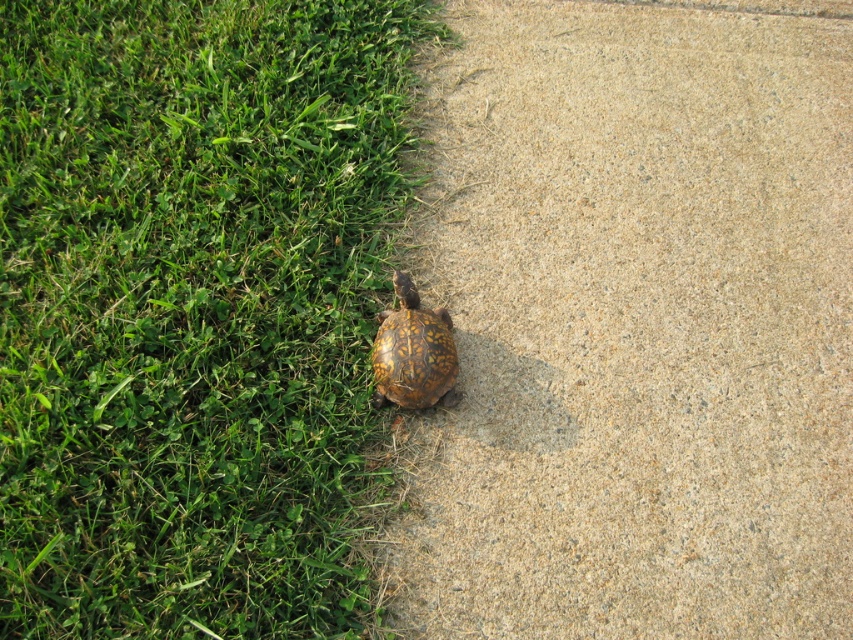
Does point (363, 582) lie in front of point (397, 324)?

Yes.

Is green grass at lower left to the left of brown textured shell at lower center from the viewer's perspective?

Indeed, green grass at lower left is positioned on the left side of brown textured shell at lower center.

Find the location of a particular element. The image size is (853, 640). green grass at lower left is located at coordinates (192, 307).

Where is `green grass at lower left`? This screenshot has width=853, height=640. green grass at lower left is located at coordinates (192, 307).

Is point (819, 624) positioned in front of point (183, 134)?

Yes.

Measure the distance between brown textured pavement at lower left and camera.

brown textured pavement at lower left and camera are 1.78 meters apart.

Is point (685, 225) positioned behind point (199, 346)?

That is True.

The width and height of the screenshot is (853, 640). I want to click on brown textured pavement at lower left, so [x=636, y=324].

Is brown textured pavement at lower left smaller than brown textured shell at lower center?

Actually, brown textured pavement at lower left might be larger than brown textured shell at lower center.

Is the position of brown textured pavement at lower left more distant than that of brown textured shell at lower center?

No, brown textured pavement at lower left is closer to the viewer.

Describe the element at coordinates (636, 324) in the screenshot. I see `brown textured pavement at lower left` at that location.

You are a GUI agent. You are given a task and a screenshot of the screen. Output one action in this format:
    pyautogui.click(x=<x>, y=<y>)
    Task: Click on the brown textured pavement at lower left
    Image resolution: width=853 pixels, height=640 pixels.
    Given the screenshot: What is the action you would take?
    pyautogui.click(x=636, y=324)